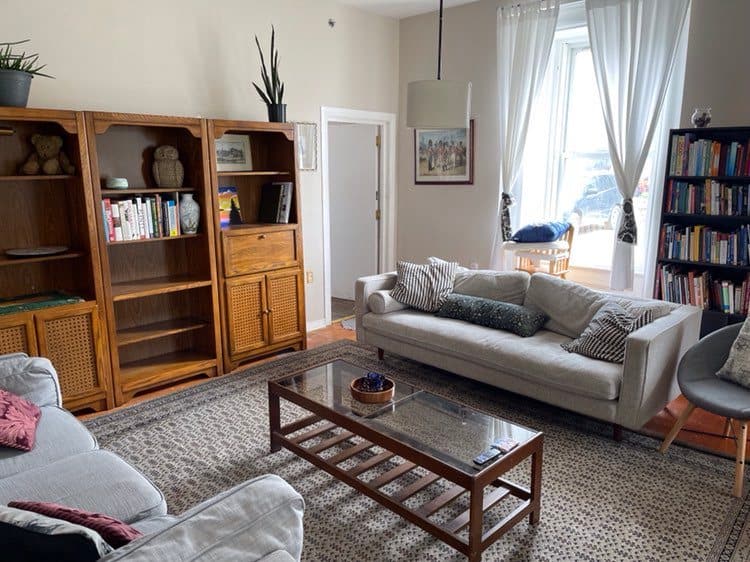
The height and width of the screenshot is (562, 750). What are the coordinates of `door` in the screenshot? It's located at (350, 203).